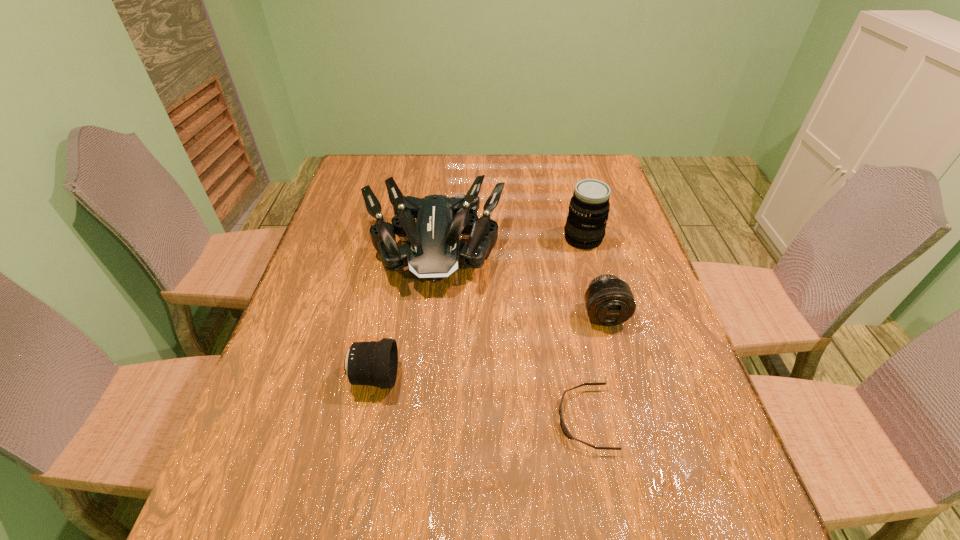
Identify which telephoto lens is the nearest to the second nearest telephoto lens. Please provide its 2D coordinates. Your answer should be formatted as a tuple, i.e. [(x, y)], where the tuple contains the x and y coordinates of a point satisfying the conditions above.

[(586, 222)]

The height and width of the screenshot is (540, 960). What are the coordinates of `the closest telephoto lens relative to the tallest object` in the screenshot? It's located at (609, 301).

Image resolution: width=960 pixels, height=540 pixels. I want to click on free space that satisfies the following two spatial constraints: 1. on the front-facing side of the second nearest telephoto lens; 2. at the front element of the leftmost telephoto lens, so click(621, 377).